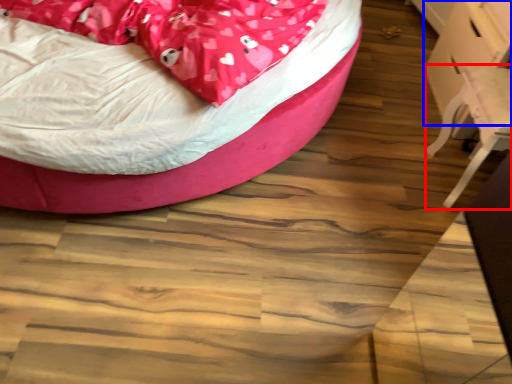
Question: Which object appears closest to the camera in this image, swivel chair (highlighted by a red box) or table (highlighted by a blue box)?

Choices:
 (A) swivel chair
 (B) table

Answer: (A)